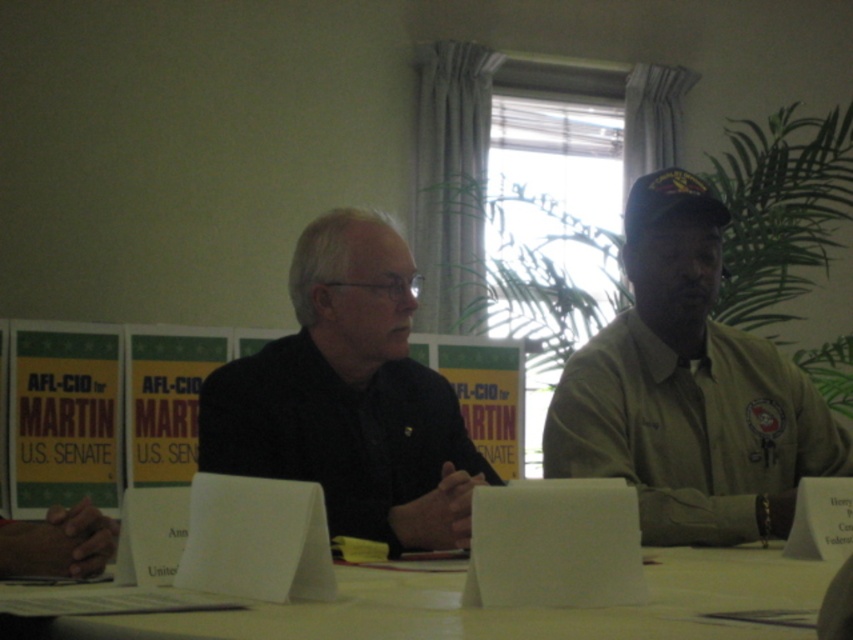
Which is more to the right, khaki uniform at center or white paper at center?

From the viewer's perspective, khaki uniform at center appears more on the right side.

Does khaki uniform at center have a greater width compared to white paper at center?

In fact, khaki uniform at center might be narrower than white paper at center.

Where is `khaki uniform at center`? The width and height of the screenshot is (853, 640). khaki uniform at center is located at coordinates (688, 388).

At what (x,y) coordinates should I click in order to perform the action: click on khaki uniform at center. Please return your answer as a coordinate pair (x, y). This screenshot has width=853, height=640. Looking at the image, I should click on (688, 388).

Can you confirm if khaki uniform at center is positioned to the right of black matte shirt at center?

Correct, you'll find khaki uniform at center to the right of black matte shirt at center.

Which is more to the left, khaki uniform at center or black matte shirt at center?

Positioned to the left is black matte shirt at center.

Does point (755, 440) lie behind point (277, 371)?

Yes, point (755, 440) is behind point (277, 371).

Identify the location of khaki uniform at center. (688, 388).

Which is more to the right, black matte shirt at center or white paper at center?

Positioned to the right is white paper at center.

Does point (392, 410) come in front of point (16, 628)?

That is False.

Between point (450, 422) and point (96, 616), which one is positioned behind?

Point (450, 422)

The height and width of the screenshot is (640, 853). What are the coordinates of `black matte shirt at center` in the screenshot? It's located at (349, 397).